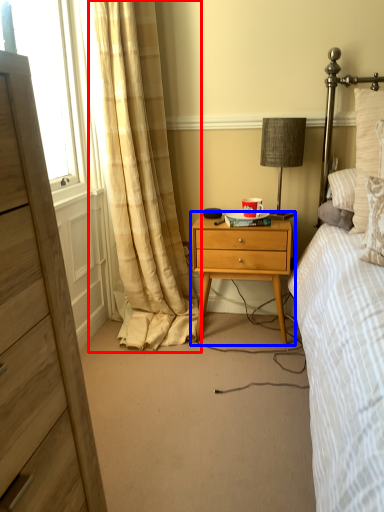
Question: Which point is further to the camera, curtain (highlighted by a red box) or nightstand (highlighted by a blue box)?

Choices:
 (A) curtain
 (B) nightstand

Answer: (B)